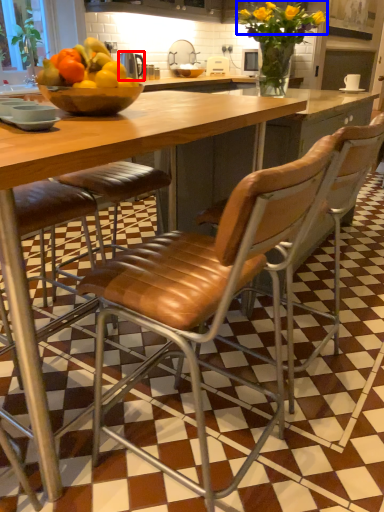
Question: Which point is closer to the camera, appliance (highlighted by a red box) or flower (highlighted by a blue box)?

Choices:
 (A) appliance
 (B) flower

Answer: (A)